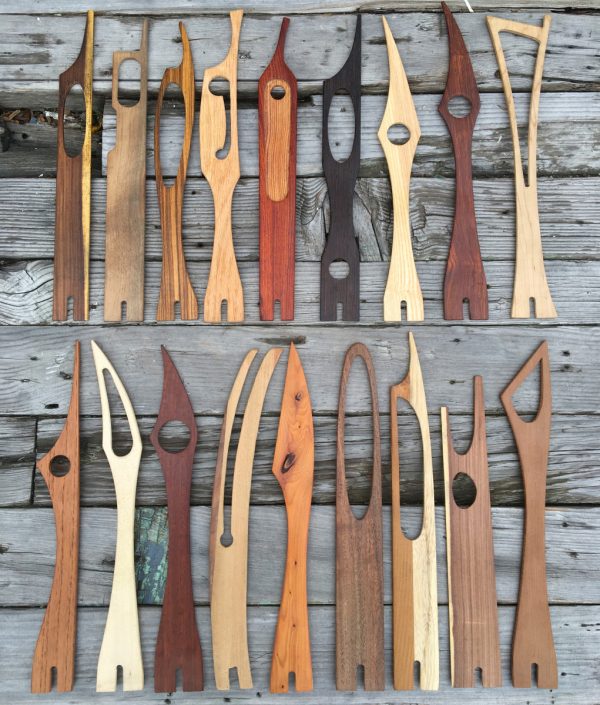
This screenshot has width=600, height=705. What are the coordinates of `chunk missing from table` in the screenshot? It's located at (37, 121).